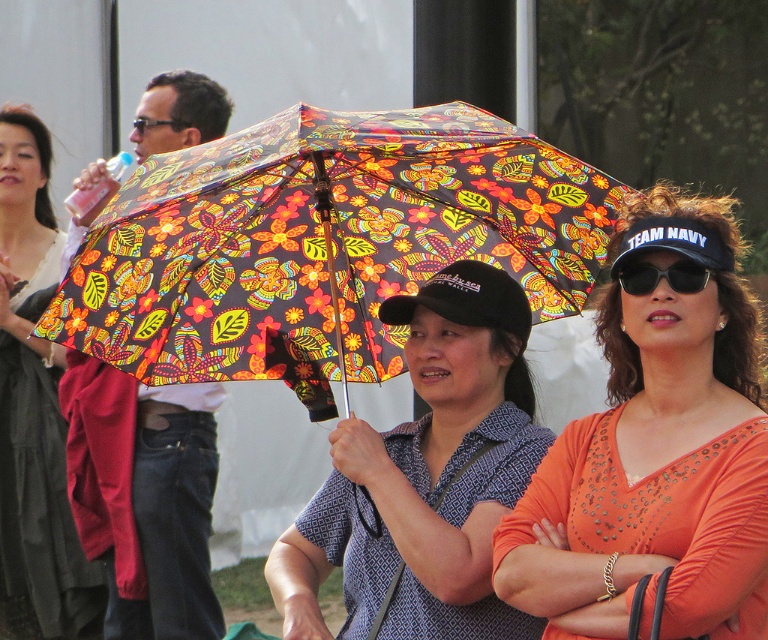
Between point (631, 448) and point (458, 618), which one is positioned in front?

Point (631, 448) is in front.

Based on the photo, can you confirm if orange jersey at center is positioned to the left of floral-patterned umbrella at center?

Incorrect, orange jersey at center is not on the left side of floral-patterned umbrella at center.

Is point (551, 605) positioned behind point (358, 512)?

No, (551, 605) is closer to viewer.

The height and width of the screenshot is (640, 768). What are the coordinates of `orange jersey at center` in the screenshot? It's located at (654, 452).

Is point (435, 262) behind point (25, 132)?

No, (435, 262) is closer to viewer.

Does point (227, 259) lie in front of point (63, 628)?

Yes, point (227, 259) is in front of point (63, 628).

Which is behind, point (396, 148) or point (45, 285)?

Positioned behind is point (45, 285).

Find the location of `floral-patterned fabric umbrella at center`. floral-patterned fabric umbrella at center is located at coordinates (323, 244).

Does floral-patterned umbrella at center appear on the left side of matte black umbrella at upper center?

No, floral-patterned umbrella at center is not to the left of matte black umbrella at upper center.

Measure the distance between floral-patterned umbrella at center and camera.

floral-patterned umbrella at center is 8.32 meters away from camera.

The image size is (768, 640). I want to click on floral-patterned umbrella at center, so click(425, 476).